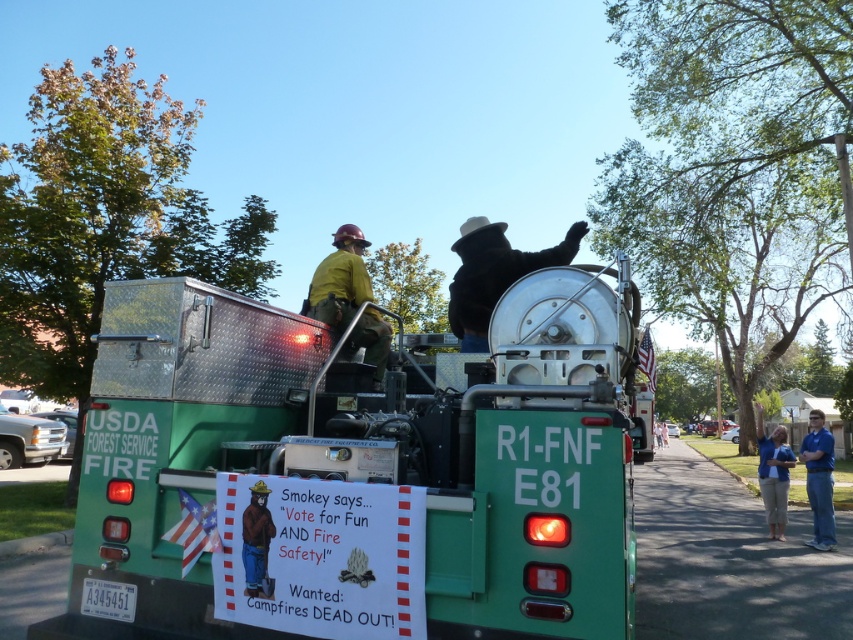
What is the relationship in size between the green aluminum fire truck at center and the yellow hard hat at center in the image?

The green aluminum fire truck at center is bigger than the yellow hard hat at center.

Based on the photo, what is the position of the green aluminum fire truck at center relative to the yellow hard hat at center?

The green aluminum fire truck at center is to the right of the yellow hard hat at center.